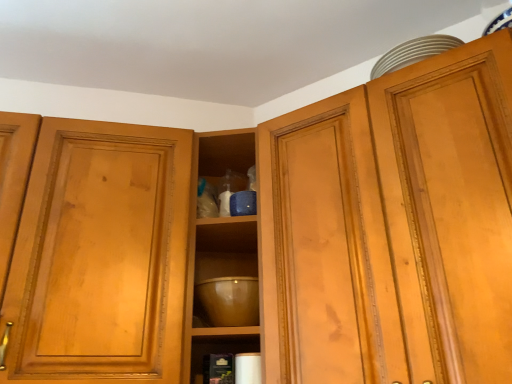
Question: Do you think matte wood cabinet at upper right is within transparent glass cabinet at upper center, or outside of it?

Choices:
 (A) inside
 (B) outside

Answer: (B)

Question: From the image's perspective, is matte wood cabinet at upper right positioned above or below transparent glass cabinet at upper center?

Choices:
 (A) below
 (B) above

Answer: (B)

Question: Which of these objects is positioned farthest from the matte wood cabinet at upper right?

Choices:
 (A) transparent glass cabinet at upper center
 (B) glossy ceramic mixing bowl at center

Answer: (A)

Question: Which object is positioned farthest from the matte wood cabinet at upper right?

Choices:
 (A) transparent glass cabinet at upper center
 (B) glossy ceramic mixing bowl at center

Answer: (A)